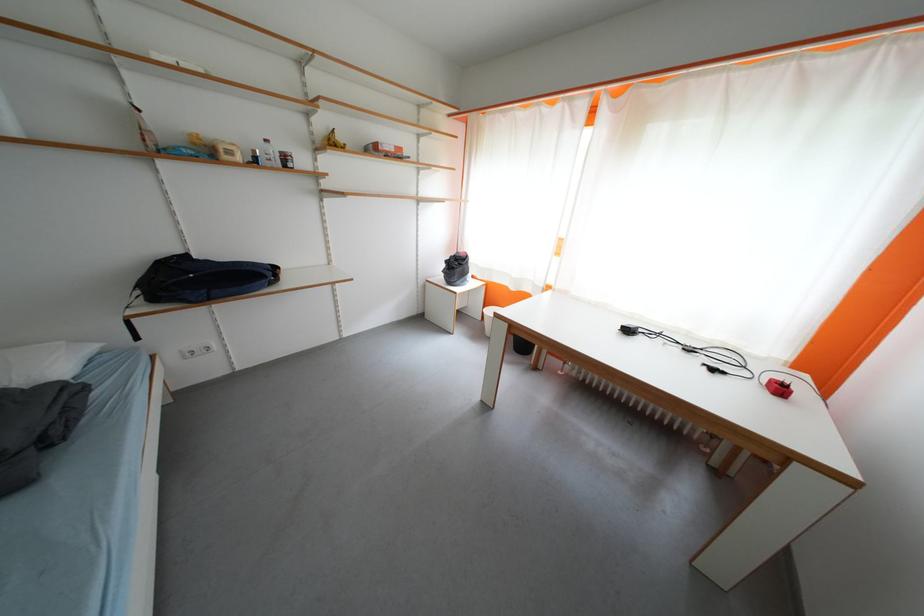
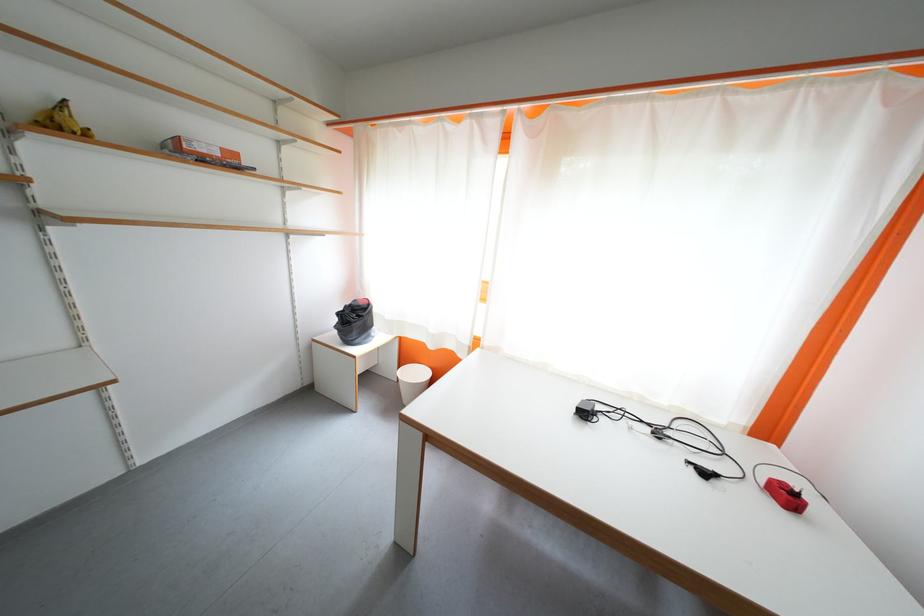
Where in the second image is the point corresponding to (x=723, y=373) from the first image?

(713, 477)